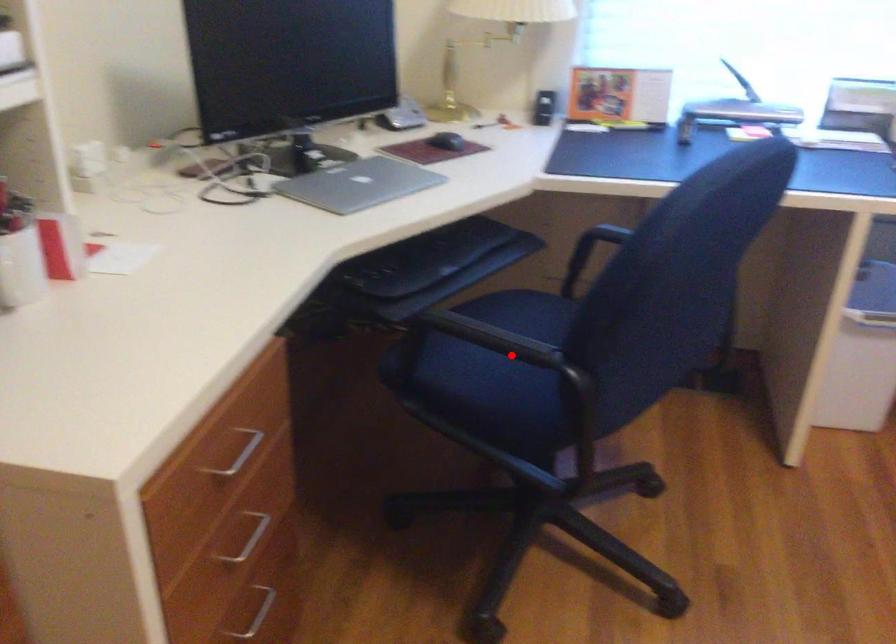
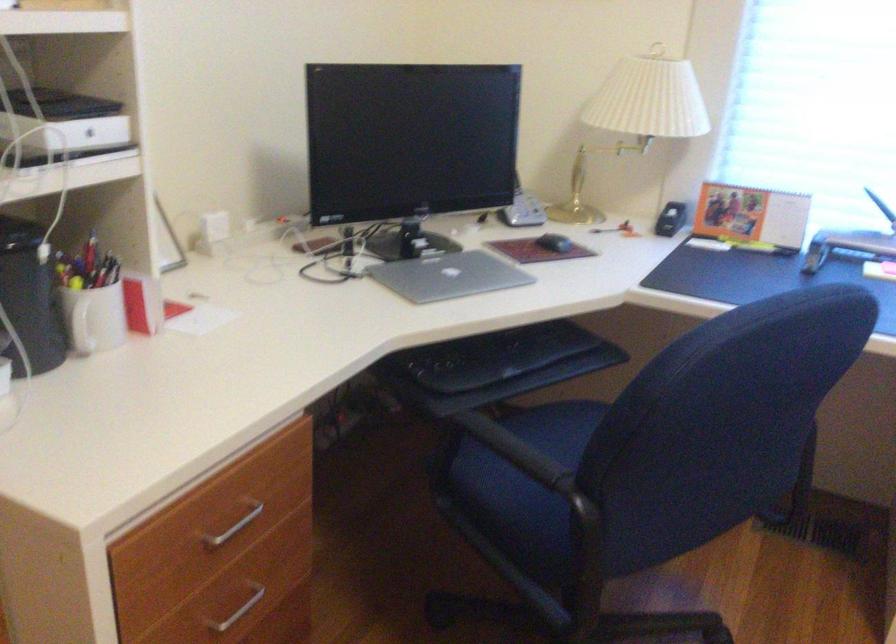
Question: I am providing you with two images of the same scene from different viewpoints. A red point is marked on the first image. Can you still see the location of the red point in image 2?

Choices:
 (A) Yes
 (B) No

Answer: (A)